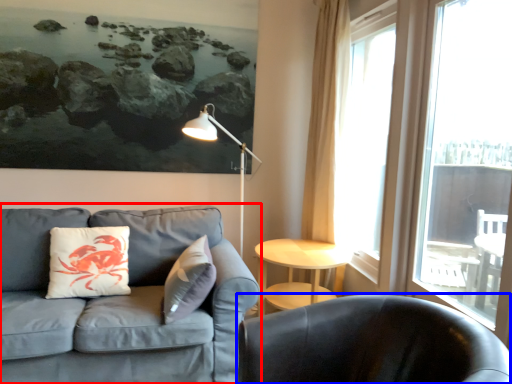
Question: Which object appears closest to the camera in this image, studio couch (highlighted by a red box) or chair (highlighted by a blue box)?

Choices:
 (A) studio couch
 (B) chair

Answer: (B)